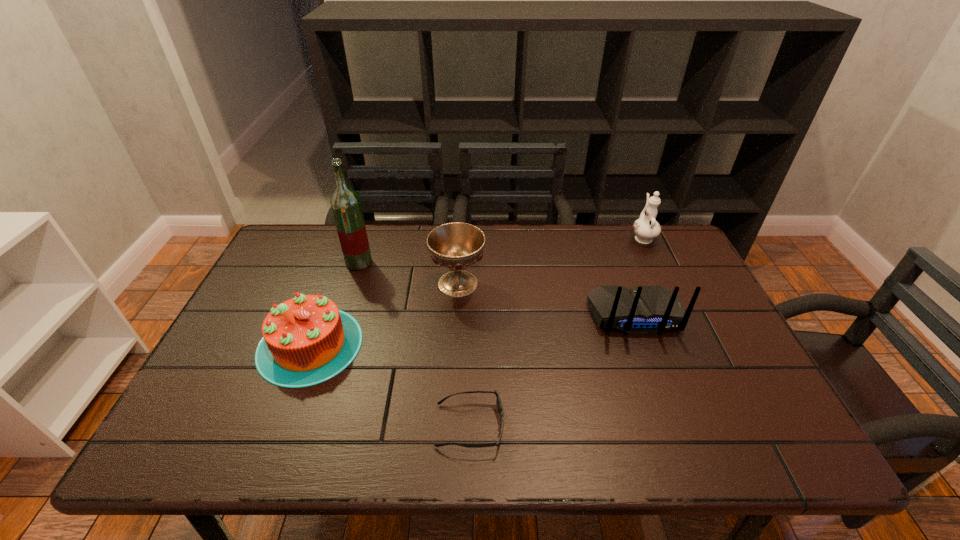
You are a GUI agent. You are given a task and a screenshot of the screen. Output one action in this format:
    pyautogui.click(x=<x>, y=<y>)
    Task: Click on the vacant space at the far edge
    This screenshot has height=540, width=960.
    Given the screenshot: What is the action you would take?
    pyautogui.click(x=539, y=234)

Identify the location of vacant space at the near edge. The width and height of the screenshot is (960, 540). (247, 436).

Find the location of a particular element. The width and height of the screenshot is (960, 540). free space at the left edge is located at coordinates (201, 386).

You are a GUI agent. You are given a task and a screenshot of the screen. Output one action in this format:
    pyautogui.click(x=<x>, y=<y>)
    Task: Click on the vacant area at the right edge
    
    Given the screenshot: What is the action you would take?
    pyautogui.click(x=656, y=271)

I want to click on free spot at the far right corner of the desktop, so click(x=672, y=258).

Where is `free region at the near right corner of the desktop`? free region at the near right corner of the desktop is located at coordinates (736, 421).

In order to click on vacant point located between the chalice and the cake in this screenshot , I will do `click(384, 314)`.

Where is `empty space between the chinaware and the chalice`? This screenshot has height=540, width=960. empty space between the chinaware and the chalice is located at coordinates (550, 260).

The width and height of the screenshot is (960, 540). Find the location of `vacant region between the cake and the chalice`. vacant region between the cake and the chalice is located at coordinates (384, 314).

This screenshot has height=540, width=960. Find the location of `free space between the cake and the farthest object`. free space between the cake and the farthest object is located at coordinates (476, 291).